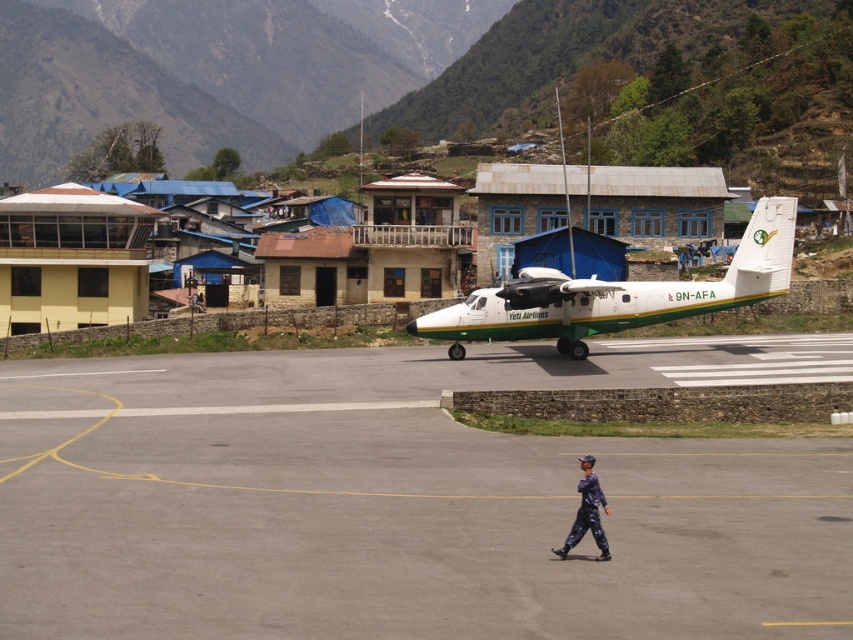
Can you confirm if gray asphalt tarmac at center is positioned to the left of purple fabric pants at center?

Indeed, gray asphalt tarmac at center is positioned on the left side of purple fabric pants at center.

Does gray asphalt tarmac at center have a larger size compared to purple fabric pants at center?

Yes, gray asphalt tarmac at center is bigger than purple fabric pants at center.

The width and height of the screenshot is (853, 640). In order to click on gray asphalt tarmac at center in this screenshot , I will do `click(405, 500)`.

Does white matte airplane at center have a greater width compared to purple fabric pants at center?

Correct, the width of white matte airplane at center exceeds that of purple fabric pants at center.

Does point (583, 310) come in front of point (587, 508)?

No, it is behind (587, 508).

Where is `white matte airplane at center`? white matte airplane at center is located at coordinates (618, 294).

The image size is (853, 640). Find the location of `gray asphalt tarmac at center`. gray asphalt tarmac at center is located at coordinates (405, 500).

Does gray asphalt tarmac at center have a smaller size compared to white matte airplane at center?

Indeed, gray asphalt tarmac at center has a smaller size compared to white matte airplane at center.

Image resolution: width=853 pixels, height=640 pixels. I want to click on gray asphalt tarmac at center, so click(x=405, y=500).

Where is `gray asphalt tarmac at center`? The height and width of the screenshot is (640, 853). gray asphalt tarmac at center is located at coordinates (405, 500).